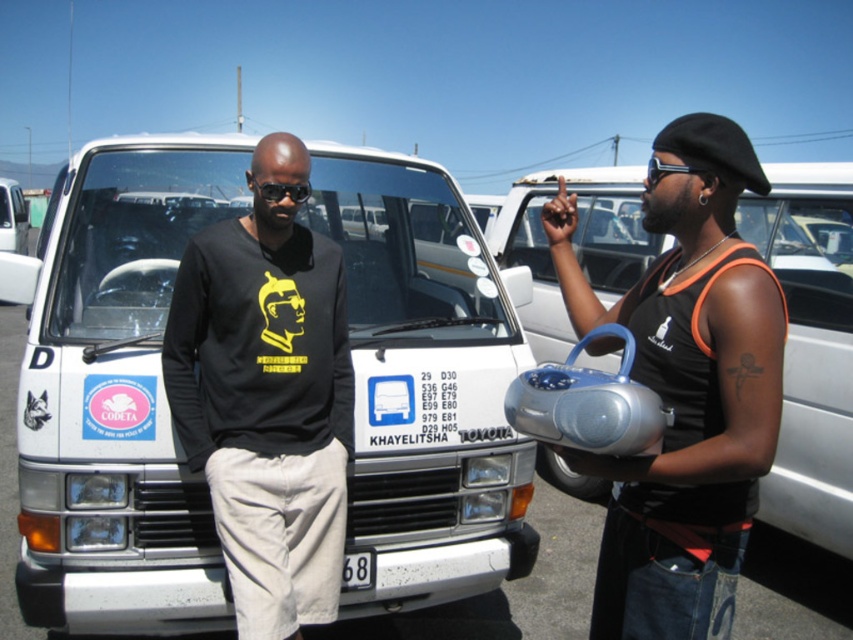
Does white matte van at center appear under black plastic sunglasses at center?

Yes, white matte van at center is below black plastic sunglasses at center.

This screenshot has height=640, width=853. Describe the element at coordinates (115, 392) in the screenshot. I see `white matte van at center` at that location.

Is point (358, 378) less distant than point (308, 192)?

That is False.

Find the location of a particular element. The image size is (853, 640). white matte van at center is located at coordinates (115, 392).

Does white matte van at center have a greater width compared to black plastic sunglasses at upper center?

Yes.

Between point (88, 481) and point (662, 172), which one is positioned in front?

Point (662, 172) is more forward.

This screenshot has width=853, height=640. Identify the location of white matte van at center. (115, 392).

Can you confirm if white plastic license plate at center is positioned below black plastic sunglasses at center?

Yes, white plastic license plate at center is below black plastic sunglasses at center.

Which is more to the left, white plastic license plate at center or black plastic sunglasses at center?

From the viewer's perspective, black plastic sunglasses at center appears more on the left side.

Which is in front, point (351, 552) or point (270, 182)?

Positioned in front is point (270, 182).

At what (x,y) coordinates should I click in order to perform the action: click on white plastic license plate at center. Please return your answer as a coordinate pair (x, y). The height and width of the screenshot is (640, 853). Looking at the image, I should click on (358, 570).